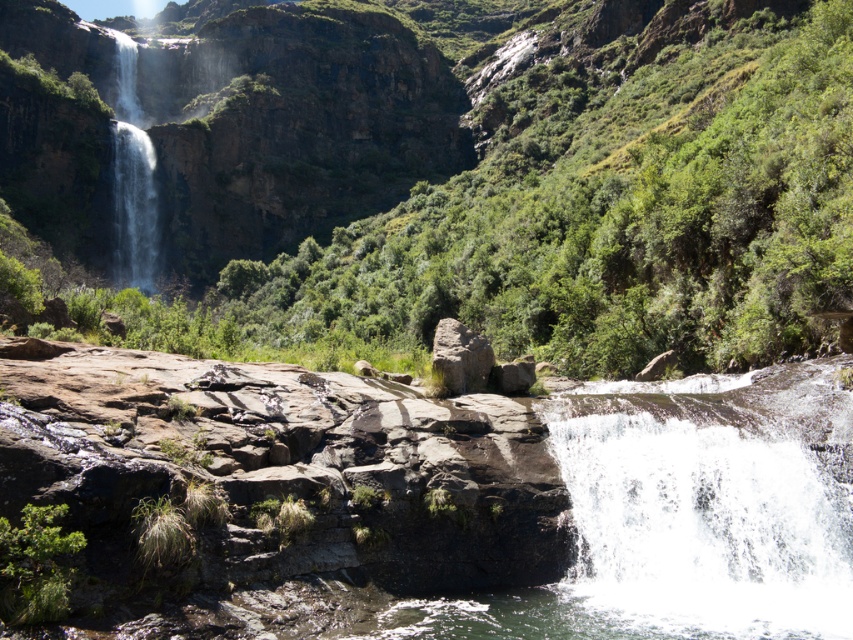
You are a hiker standing at the base of the waterfalls. You want to climb up to the higher waterfall. Which direction should you go from the white frothy water at lower right to reach the white frothy water at upper left?

You should go towards the upper left direction from the white frothy water at lower right to reach the white frothy water at upper left, as the white frothy water at lower right is not as tall as the one at upper left, indicating it is lower in elevation.

You are standing at the edge of the pool below the waterfalls. You see the white frothy water at lower right and the rusty rock at center. Which object is closer to you?

The white frothy water at lower right is closer to you because it is in front of the rusty rock at center.